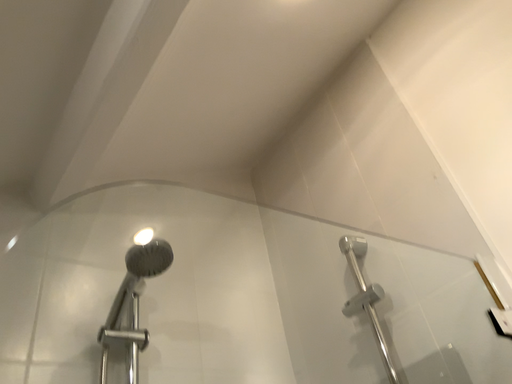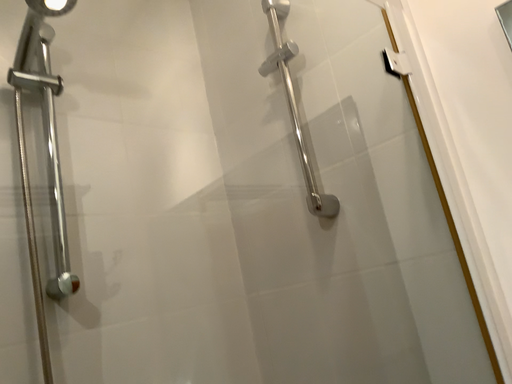
Question: How did the camera likely rotate when shooting the video?

Choices:
 (A) rotated downward
 (B) rotated upward

Answer: (A)